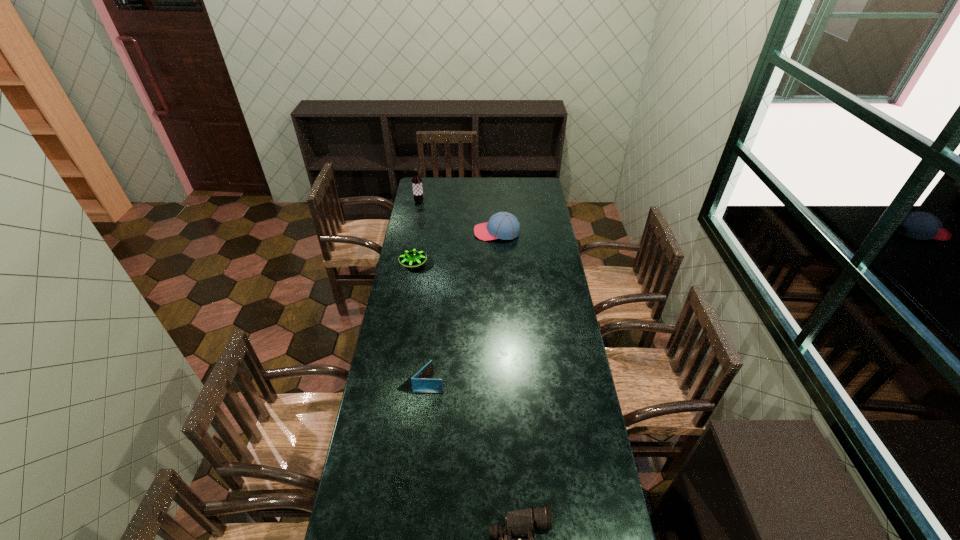
Where is `free spot between the third shortest object and the tallest object`? The image size is (960, 540). free spot between the third shortest object and the tallest object is located at coordinates (424, 293).

Identify the location of free space that is in between the tallest object and the baseball cap. (458, 217).

In order to click on free space between the baseball cap and the tallest object in this screenshot , I will do `click(458, 217)`.

Image resolution: width=960 pixels, height=540 pixels. Identify the location of object that is the third closest one to the third shortest object. (503, 225).

Identify the location of object that stands as the second closest to the saucer. (416, 180).